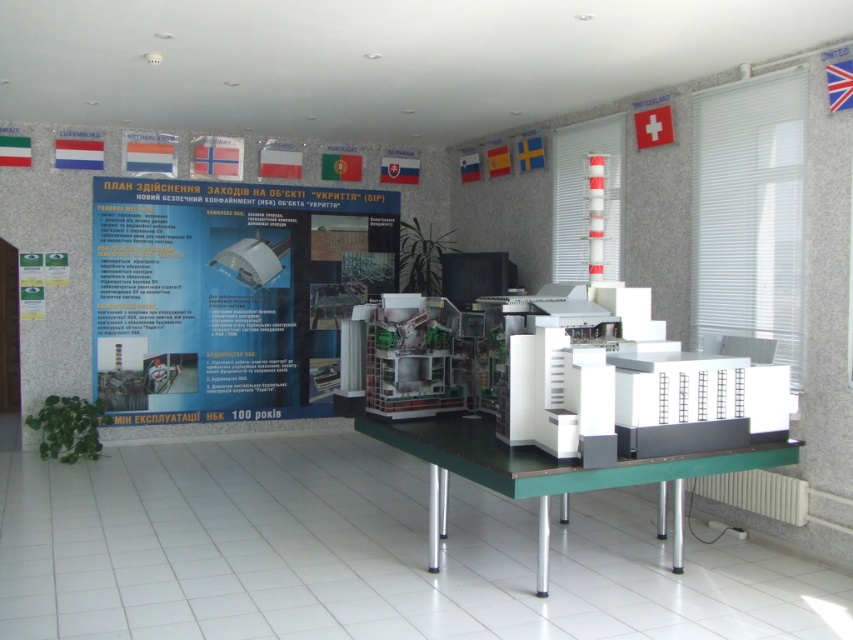
Does white paper at center have a smaller size compared to green plastic table at center?

Incorrect, white paper at center is not smaller in size than green plastic table at center.

The height and width of the screenshot is (640, 853). Describe the element at coordinates (229, 294) in the screenshot. I see `white paper at center` at that location.

Find the location of a particular element. white paper at center is located at coordinates (x=229, y=294).